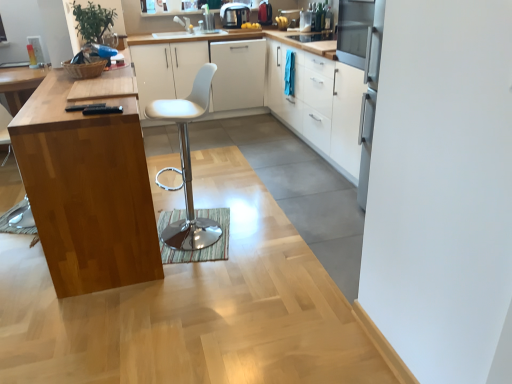
Locate an element on the screen. The image size is (512, 384). white leather swivel chair at center is located at coordinates (187, 164).

Describe the element at coordinates (319, 104) in the screenshot. I see `white glossy cabinets at upper center, which is counted as the 1th cabinetry, starting from the right` at that location.

Image resolution: width=512 pixels, height=384 pixels. Describe the element at coordinates (265, 13) in the screenshot. I see `metallic silver toaster at upper center, positioned as the 2th appliance in left-to-right order` at that location.

What do you see at coordinates (234, 15) in the screenshot? Image resolution: width=512 pixels, height=384 pixels. I see `metallic silver toaster at upper center, which is the 1th appliance in left-to-right order` at bounding box center [234, 15].

This screenshot has width=512, height=384. What do you see at coordinates (282, 88) in the screenshot?
I see `white glossy cabinet at center, arranged as the second cabinetry when viewed from the right` at bounding box center [282, 88].

At what (x,y) coordinates should I click in order to perform the action: click on white matte cabinet at center, which ranks as the third cabinetry in right-to-left order. Please return your answer as a coordinate pair (x, y). This screenshot has width=512, height=384. Looking at the image, I should click on (238, 74).

The height and width of the screenshot is (384, 512). Identify the location of white leather swivel chair at center. (187, 164).

This screenshot has width=512, height=384. What are the coordinates of `appliance that is the 1st one when counting rightward from the white matte cabinet at center, the 4th cabinetry viewed from the right` in the screenshot? It's located at (234, 15).

Which is more to the left, metallic silver toaster at upper center, which is the 1th appliance in left-to-right order, or white matte cabinet at center, the 4th cabinetry viewed from the right?

From the viewer's perspective, white matte cabinet at center, the 4th cabinetry viewed from the right, appears more on the left side.

Could you tell me if metallic silver toaster at upper center, which ranks as the 2th appliance in right-to-left order, is facing white matte cabinet at center, the 4th cabinetry viewed from the right?

No, metallic silver toaster at upper center, which ranks as the 2th appliance in right-to-left order, is not oriented towards white matte cabinet at center, the 4th cabinetry viewed from the right.

From the image's perspective, which one is positioned higher, metallic silver toaster at upper center, positioned as the 2th appliance in left-to-right order, or white matte cabinet at center, the 4th cabinetry viewed from the right?

metallic silver toaster at upper center, positioned as the 2th appliance in left-to-right order, is shown above in the image.

In terms of height, does metallic silver toaster at upper center, positioned as the 2th appliance in left-to-right order, look taller or shorter compared to white matte cabinet at center, the 4th cabinetry viewed from the right?

Considering their sizes, metallic silver toaster at upper center, positioned as the 2th appliance in left-to-right order, has less height than white matte cabinet at center, the 4th cabinetry viewed from the right.

How distant is metallic silver toaster at upper center, positioned as the 2th appliance in left-to-right order, from white matte cabinet at center, the 4th cabinetry viewed from the right?

A distance of 32.82 inches exists between metallic silver toaster at upper center, positioned as the 2th appliance in left-to-right order, and white matte cabinet at center, the 4th cabinetry viewed from the right.

Which of these two, metallic silver toaster at upper center, positioned as the 2th appliance in left-to-right order, or white glossy cabinets at upper center, the fourth cabinetry viewed from the left, is bigger?

white glossy cabinets at upper center, the fourth cabinetry viewed from the left, is bigger.

Considering the sizes of objects metallic silver toaster at upper center, positioned as the 2th appliance in left-to-right order, and white glossy cabinets at upper center, which is counted as the 1th cabinetry, starting from the right, in the image provided, who is thinner, metallic silver toaster at upper center, positioned as the 2th appliance in left-to-right order, or white glossy cabinets at upper center, which is counted as the 1th cabinetry, starting from the right,?

metallic silver toaster at upper center, positioned as the 2th appliance in left-to-right order.

The image size is (512, 384). There is a white glossy cabinets at upper center, the fourth cabinetry viewed from the left. Find the location of `the 2nd appliance above it (from the image's perspective)`. the 2nd appliance above it (from the image's perspective) is located at coordinates (265, 13).

From a real-world perspective, is metallic silver toaster at upper center, the 1th appliance in the right-to-left sequence, positioned under white glossy cabinets at upper center, the fourth cabinetry viewed from the left, based on gravity?

Actually, metallic silver toaster at upper center, the 1th appliance in the right-to-left sequence, is physically above white glossy cabinets at upper center, the fourth cabinetry viewed from the left, in the real world.

Locate an element on the screen. the 1st cabinetry in front of the white matte cabinet at center, the 4th cabinetry viewed from the right is located at coordinates (319, 104).

Considering the relative sizes of white matte cabinet at center, marked as the 1th cabinetry in a left-to-right arrangement, and white glossy cabinets at upper center, which is counted as the 1th cabinetry, starting from the right, in the image provided, is white matte cabinet at center, marked as the 1th cabinetry in a left-to-right arrangement, bigger than white glossy cabinets at upper center, which is counted as the 1th cabinetry, starting from the right,?

Incorrect, white matte cabinet at center, marked as the 1th cabinetry in a left-to-right arrangement, is not larger than white glossy cabinets at upper center, which is counted as the 1th cabinetry, starting from the right.

Is white matte cabinet at center, the 4th cabinetry viewed from the right, completely or partially outside of white glossy cabinets at upper center, which is counted as the 1th cabinetry, starting from the right?

Yes, white matte cabinet at center, the 4th cabinetry viewed from the right, is outside of white glossy cabinets at upper center, which is counted as the 1th cabinetry, starting from the right.

How many degrees apart are the facing directions of white matte cabinet at center, the 4th cabinetry viewed from the right, and white glossy cabinets at upper center, the fourth cabinetry viewed from the left?

91.2 degrees separate the facing orientations of white matte cabinet at center, the 4th cabinetry viewed from the right, and white glossy cabinets at upper center, the fourth cabinetry viewed from the left.

Is white glossy cabinets at upper center, the fourth cabinetry viewed from the left, facing towards metallic silver toaster at upper center, the 1th appliance in the right-to-left sequence?

No, white glossy cabinets at upper center, the fourth cabinetry viewed from the left, is not aimed at metallic silver toaster at upper center, the 1th appliance in the right-to-left sequence.

Choose the correct answer: Is white glossy cabinets at upper center, the fourth cabinetry viewed from the left, inside metallic silver toaster at upper center, positioned as the 2th appliance in left-to-right order, or outside it?

white glossy cabinets at upper center, the fourth cabinetry viewed from the left, cannot be found inside metallic silver toaster at upper center, positioned as the 2th appliance in left-to-right order.

What's the angular difference between white glossy cabinets at upper center, which is counted as the 1th cabinetry, starting from the right, and metallic silver toaster at upper center, positioned as the 2th appliance in left-to-right order,'s facing directions?

The angle between the facing direction of white glossy cabinets at upper center, which is counted as the 1th cabinetry, starting from the right, and the facing direction of metallic silver toaster at upper center, positioned as the 2th appliance in left-to-right order, is 90.2 degrees.

In terms of height, does white glossy cabinets at upper center, which is counted as the 1th cabinetry, starting from the right, look taller or shorter compared to metallic silver toaster at upper center, the 1th appliance in the right-to-left sequence?

In the image, white glossy cabinets at upper center, which is counted as the 1th cabinetry, starting from the right, appears to be taller than metallic silver toaster at upper center, the 1th appliance in the right-to-left sequence.

Can you confirm if wooden cutting board at left is wider than white leather swivel chair at center?

Yes, wooden cutting board at left is wider than white leather swivel chair at center.

Between wooden cutting board at left and white leather swivel chair at center, which one has larger size?

With larger size is wooden cutting board at left.

Are wooden cutting board at left and white leather swivel chair at center far apart?

They are positioned close to each other.

Which is more to the right, white matte cabinet at center, the 4th cabinetry viewed from the right, or white leather swivel chair at center?

white leather swivel chair at center.

Who is more distant, white matte cabinet at center, the 4th cabinetry viewed from the right, or white leather swivel chair at center?

white matte cabinet at center, the 4th cabinetry viewed from the right, is behind.

Is white matte cabinet at center, the 4th cabinetry viewed from the right, facing away from white leather swivel chair at center?

white matte cabinet at center, the 4th cabinetry viewed from the right, is not turned away from white leather swivel chair at center.

Identify the location of the 1st appliance positioned above the white matte cabinet at center, the 4th cabinetry viewed from the right (from the image's perspective). Image resolution: width=512 pixels, height=384 pixels. (234, 15).

From the white matte cabinet at center, marked as the 1th cabinetry in a left-to-right arrangement, count 2nd appliance to the right and point to it. Please provide its 2D coordinates.

[(265, 13)]

Based on the photo, estimate the real-world distances between objects in this image. Which object is further from white glossy cabinet at center, marked as the 3th cabinetry in a left-to-right arrangement, metallic silver toaster at upper center, which is the 1th appliance in left-to-right order, or wooden cutting board at left?

wooden cutting board at left is further to white glossy cabinet at center, marked as the 3th cabinetry in a left-to-right arrangement.

Which object lies further to the anchor point metallic silver toaster at upper center, the 1th appliance in the right-to-left sequence, white matte cabinet at center, which ranks as the 2th cabinetry in left-to-right order, or white glossy cabinet at center, arranged as the second cabinetry when viewed from the right?

white glossy cabinet at center, arranged as the second cabinetry when viewed from the right, lies further to metallic silver toaster at upper center, the 1th appliance in the right-to-left sequence, than the other object.

Looking at this image, from the image, which object appears to be farther from white matte cabinet at center, marked as the 1th cabinetry in a left-to-right arrangement, white glossy cabinets at upper center, which is counted as the 1th cabinetry, starting from the right, or white matte cabinet at center, which ranks as the 2th cabinetry in left-to-right order?

white glossy cabinets at upper center, which is counted as the 1th cabinetry, starting from the right, is further to white matte cabinet at center, marked as the 1th cabinetry in a left-to-right arrangement.

From the image, which object appears to be nearer to wooden cutting board at left, white glossy cabinets at upper center, the fourth cabinetry viewed from the left, or white matte cabinet at center, the 4th cabinetry viewed from the right?

Among the two, white glossy cabinets at upper center, the fourth cabinetry viewed from the left, is located nearer to wooden cutting board at left.

From the image, which object appears to be farther from white matte cabinet at center, which ranks as the 2th cabinetry in left-to-right order, metallic silver toaster at upper center, the 1th appliance in the right-to-left sequence, or white matte cabinet at center, marked as the 1th cabinetry in a left-to-right arrangement?

metallic silver toaster at upper center, the 1th appliance in the right-to-left sequence, lies further to white matte cabinet at center, which ranks as the 2th cabinetry in left-to-right order, than the other object.

Which object lies further to the anchor point wooden cutting board at left, metallic silver toaster at upper center, positioned as the 2th appliance in left-to-right order, or white glossy cabinet at center, arranged as the second cabinetry when viewed from the right?

metallic silver toaster at upper center, positioned as the 2th appliance in left-to-right order.

From the image, which object appears to be farther from metallic silver toaster at upper center, positioned as the 2th appliance in left-to-right order, white glossy cabinets at upper center, the fourth cabinetry viewed from the left, or white glossy cabinet at center, arranged as the second cabinetry when viewed from the right?

white glossy cabinets at upper center, the fourth cabinetry viewed from the left, is further to metallic silver toaster at upper center, positioned as the 2th appliance in left-to-right order.

Considering their positions, is wooden cutting board at left positioned further to white glossy cabinets at upper center, the fourth cabinetry viewed from the left, than white matte cabinet at center, which ranks as the third cabinetry in right-to-left order?

wooden cutting board at left is positioned further to the anchor white glossy cabinets at upper center, the fourth cabinetry viewed from the left.

At what (x,y) coordinates should I click in order to perform the action: click on appliance between white matte cabinet at center, the 4th cabinetry viewed from the right, and metallic silver toaster at upper center, the 1th appliance in the right-to-left sequence, from left to right. Please return your answer as a coordinate pair (x, y). This screenshot has height=384, width=512. Looking at the image, I should click on (234, 15).

The image size is (512, 384). What are the coordinates of `cabinetry positioned between white leather swivel chair at center and white glossy cabinets at upper center, the fourth cabinetry viewed from the left, from near to far` in the screenshot? It's located at (282, 88).

Identify the location of cabinetry between white glossy cabinets at upper center, the fourth cabinetry viewed from the left, and white matte cabinet at center, which ranks as the 2th cabinetry in left-to-right order, along the z-axis. The image size is (512, 384). (198, 70).

The height and width of the screenshot is (384, 512). In order to click on swivel chair between wooden cutting board at left and metallic silver toaster at upper center, the 1th appliance in the right-to-left sequence, from front to back in this screenshot , I will do `click(187, 164)`.